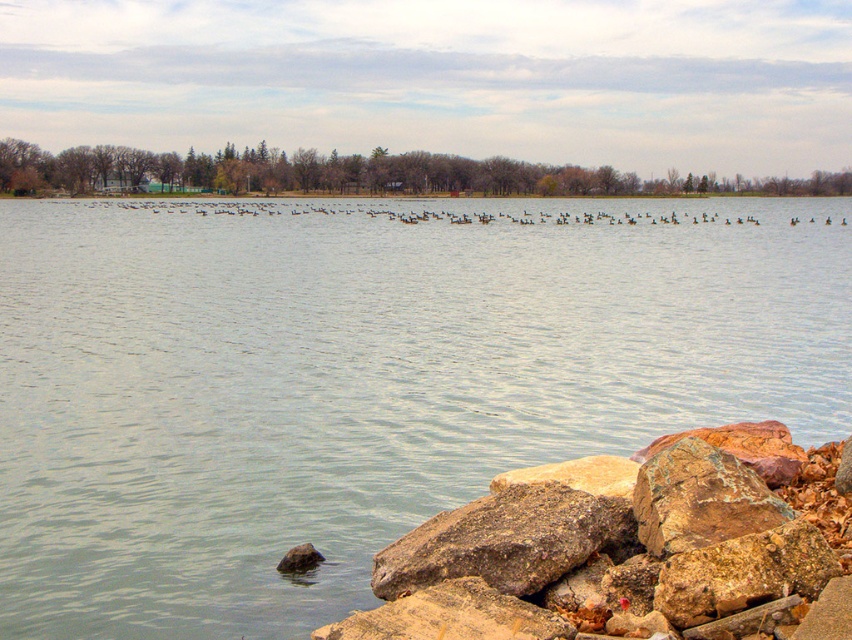
Is point (471, 236) closer to camera compared to point (629, 592)?

No, it is not.

Which is below, clear water at center or rusty stone pile at lower right?

Positioned lower is rusty stone pile at lower right.

Is point (43, 396) positioned in front of point (538, 525)?

No, (43, 396) is further to viewer.

The image size is (852, 640). Find the location of `clear water at center`. clear water at center is located at coordinates (361, 381).